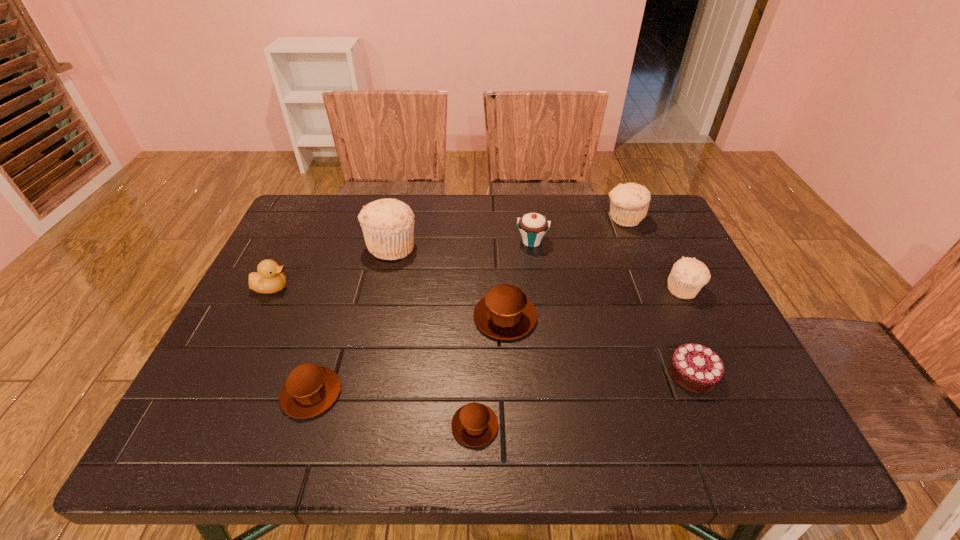
You are a GUI agent. You are given a task and a screenshot of the screen. Output one action in this format:
    pyautogui.click(x=<x>, y=<y>)
    Task: Click on the tallest object
    This screenshot has width=960, height=540.
    Given the screenshot: What is the action you would take?
    pyautogui.click(x=388, y=224)

Identify the location of the biggest beige muffin. (388, 224).

Identify the location of the fifth shortest muffin. (629, 203).

Locate an element on the screen. the second biggest beige muffin is located at coordinates (x=629, y=203).

The width and height of the screenshot is (960, 540). I want to click on cupcake, so click(x=532, y=226).

Identify the location of the leftmost object. (270, 279).

This screenshot has width=960, height=540. In order to click on the nearest beige muffin in this screenshot , I will do `click(688, 275)`.

The height and width of the screenshot is (540, 960). I want to click on the biggest brown muffin, so click(505, 313).

Identify the location of the leftmost brown muffin. (310, 389).

At what (x,y) coordinates should I click in order to perform the action: click on the second shortest muffin. Please return your answer as a coordinate pair (x, y). This screenshot has height=540, width=960. Looking at the image, I should click on (310, 389).